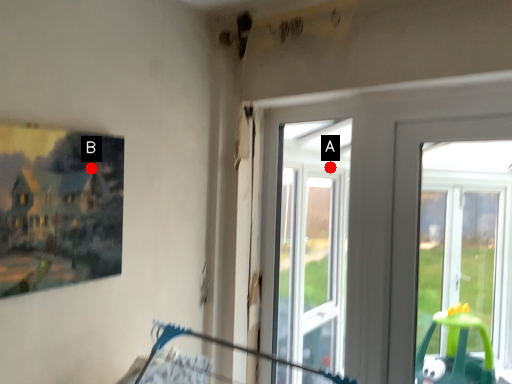
Question: Two points are circled on the image, labeled by A and B beside each circle. Which point is farther to the camera?

Choices:
 (A) A is further
 (B) B is further

Answer: (A)